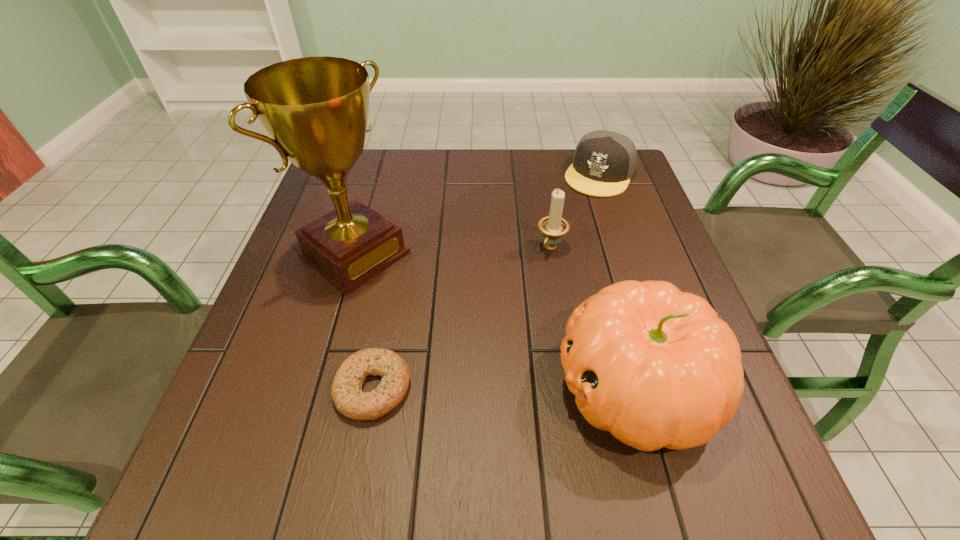
Locate an element on the screen. This screenshot has height=540, width=960. bagel that is at the near edge is located at coordinates (349, 400).

Where is `pumpkin present at the near edge`? This screenshot has height=540, width=960. pumpkin present at the near edge is located at coordinates (656, 367).

This screenshot has height=540, width=960. I want to click on object positioned at the left edge, so click(x=316, y=109).

This screenshot has height=540, width=960. I want to click on pumpkin located at the right edge, so click(x=656, y=367).

Find the location of a particular element. The width and height of the screenshot is (960, 540). cap that is at the right edge is located at coordinates (604, 161).

Find the location of a particular element. object located in the far right corner section of the desktop is located at coordinates (604, 161).

At what (x,y) coordinates should I click in order to perform the action: click on object that is at the near right corner. Please return your answer as a coordinate pair (x, y). The image size is (960, 540). Looking at the image, I should click on (656, 367).

You are a GUI agent. You are given a task and a screenshot of the screen. Output one action in this format:
    pyautogui.click(x=<x>, y=<y>)
    Task: Click on the vacant region at the far edge of the desktop
    This screenshot has width=960, height=540.
    Given the screenshot: What is the action you would take?
    pyautogui.click(x=513, y=174)

The height and width of the screenshot is (540, 960). What are the coordinates of `free region at the near edge` in the screenshot? It's located at (374, 423).

Locate an element on the screen. free space at the left edge of the desktop is located at coordinates (256, 387).